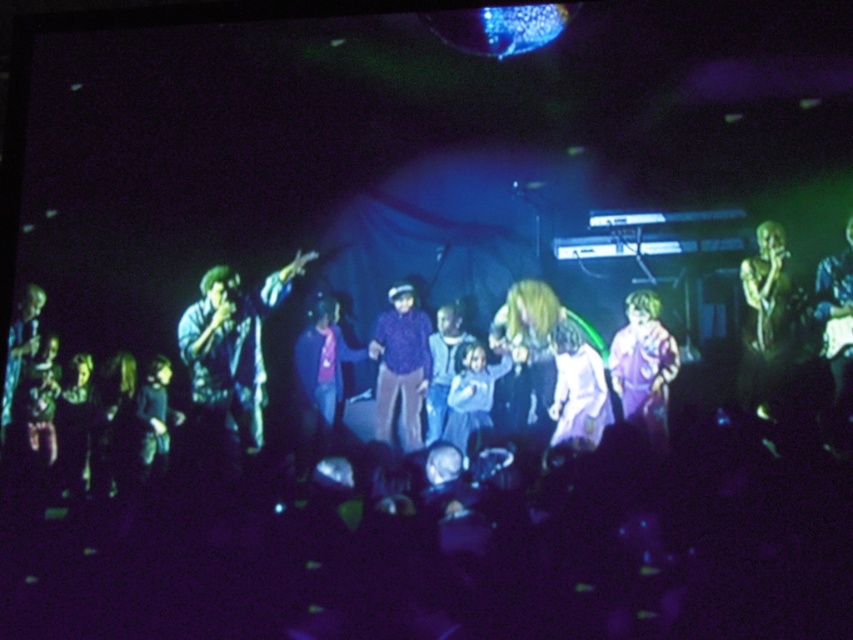
You are a stagehand who needs to adjust the height of the shiny gold microphone at right and the light blue fabric at center. According to the scene description, which object is taller and requires adjustment to be shorter?

The shiny gold microphone at right is taller than the light blue fabric at center, so the shiny gold microphone at right requires adjustment to be shorter.